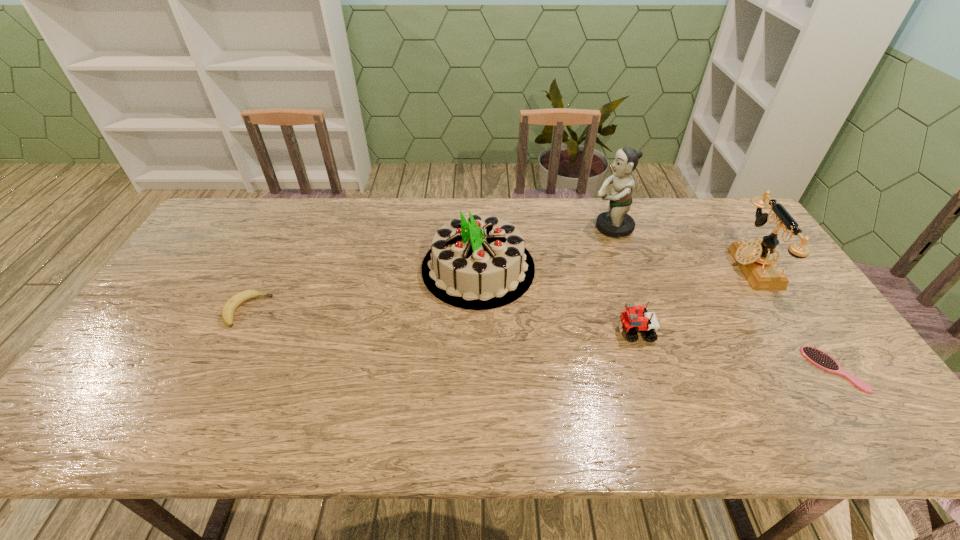
I want to click on figurine that is at the far edge, so click(616, 222).

Locate an element on the screen. birthday cake situated at the far edge is located at coordinates (477, 262).

At what (x,y) coordinates should I click in order to perform the action: click on telephone that is at the far edge. Please return your answer as a coordinate pair (x, y). Looking at the image, I should click on (756, 260).

The width and height of the screenshot is (960, 540). I want to click on telephone situated at the right edge, so click(x=756, y=260).

Locate an element on the screen. hairbrush that is at the right edge is located at coordinates (817, 357).

Find the location of `object that is at the far right corner`. object that is at the far right corner is located at coordinates click(x=756, y=260).

Locate an element on the screen. This screenshot has width=960, height=540. vacant region at the far edge of the desktop is located at coordinates (318, 215).

This screenshot has height=540, width=960. In the image, there is a desktop. In order to click on vacant region at the near edge in this screenshot , I will do `click(635, 407)`.

Locate an element on the screen. unoccupied position between the tallest object and the telephone is located at coordinates (682, 247).

Locate an element on the screen. vacant space in between the birthday cake and the figurine is located at coordinates (544, 248).